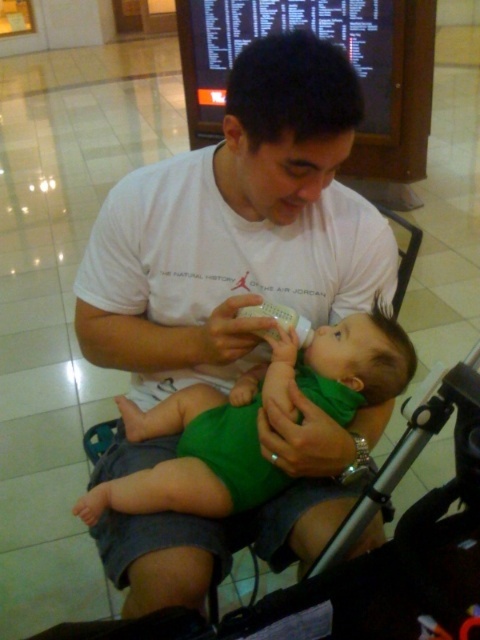
Between green fabric baby at center and clear plastic bottle at center, which one has more height?

green fabric baby at center

Consider the image. Can you confirm if green fabric baby at center is positioned to the left of clear plastic bottle at center?

Yes, green fabric baby at center is to the left of clear plastic bottle at center.

Is point (240, 436) closer to camera compared to point (302, 346)?

Yes, it is in front of point (302, 346).

What are the coordinates of `green fabric baby at center` in the screenshot? It's located at (252, 420).

Can you confirm if white cotton shirt at center is bigger than clear plastic bottle at center?

Indeed, white cotton shirt at center has a larger size compared to clear plastic bottle at center.

I want to click on white cotton shirt at center, so [237, 228].

Between point (101, 360) and point (303, 320), which one is positioned in front?

Positioned in front is point (303, 320).

You are a GUI agent. You are given a task and a screenshot of the screen. Output one action in this format:
    pyautogui.click(x=<x>, y=<y>)
    Task: Click on the white cotton shirt at center
    
    Given the screenshot: What is the action you would take?
    pyautogui.click(x=237, y=228)

Who is more forward, (333,49) or (78,509)?

Point (333,49) is more forward.

Where is `white cotton shirt at center`? The width and height of the screenshot is (480, 640). white cotton shirt at center is located at coordinates tap(237, 228).